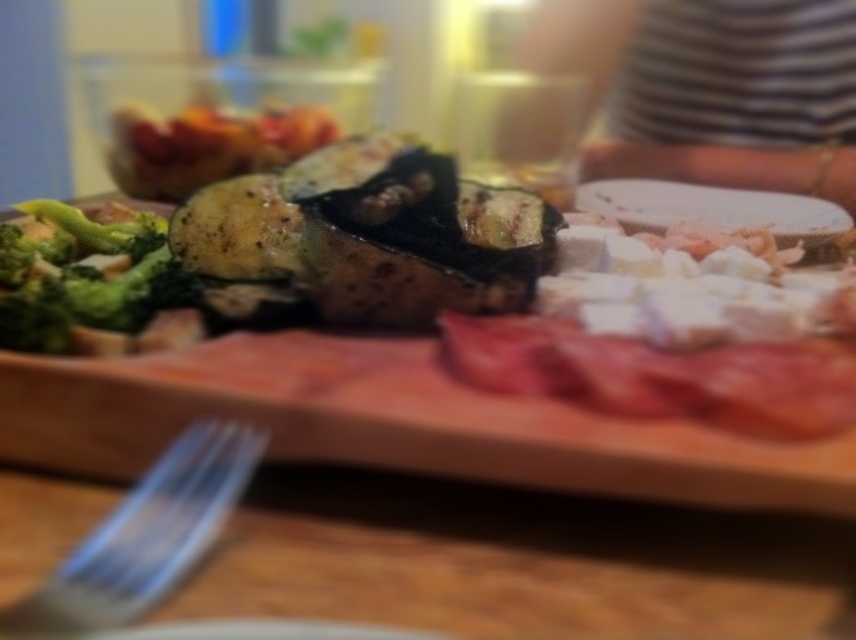
Question: Is silver metallic fork at lower left positioned behind green matte broccoli at left?

Choices:
 (A) yes
 (B) no

Answer: (B)

Question: Which object appears farthest from the camera in this image?

Choices:
 (A) green matte broccoli at left
 (B) grilled eggplant at center
 (C) silver metallic fork at lower left

Answer: (A)

Question: Which of these objects is positioned closest to the green matte broccoli at left?

Choices:
 (A) grilled eggplant at center
 (B) silver metallic fork at lower left

Answer: (A)

Question: Considering the relative positions of grilled eggplant at center and green matte broccoli at left in the image provided, where is grilled eggplant at center located with respect to green matte broccoli at left?

Choices:
 (A) above
 (B) below

Answer: (A)

Question: Considering the relative positions of silver metallic fork at lower left and green matte broccoli at left in the image provided, where is silver metallic fork at lower left located with respect to green matte broccoli at left?

Choices:
 (A) right
 (B) left

Answer: (A)

Question: Which object is closer to the camera taking this photo?

Choices:
 (A) silver metallic fork at lower left
 (B) grilled eggplant at center

Answer: (A)